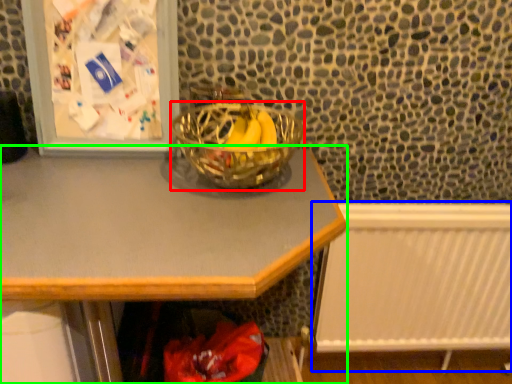
Question: Which is farther away from glass bowl (highlighted by a red box)? radiator (highlighted by a blue box) or desk (highlighted by a green box)?

Choices:
 (A) radiator
 (B) desk

Answer: (A)